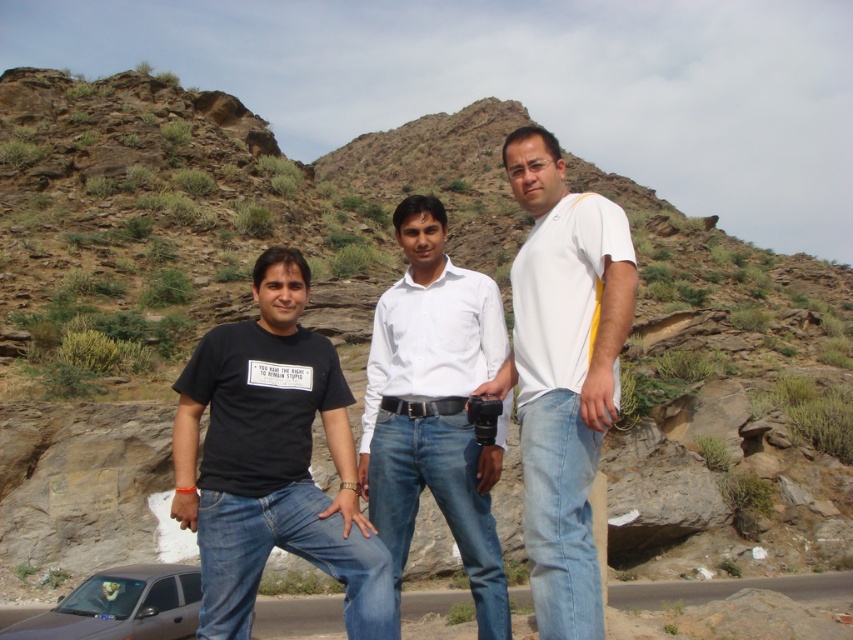
In the scene shown: How much distance is there between black matte t-shirt at left and white smooth shirt at center?

black matte t-shirt at left and white smooth shirt at center are 11.46 feet apart from each other.

Which is above, black matte t-shirt at left or white smooth shirt at center?

white smooth shirt at center is higher up.

Does point (305, 342) come closer to viewer compared to point (480, 456)?

No, (305, 342) is further to viewer.

Where is `black matte t-shirt at left`? Image resolution: width=853 pixels, height=640 pixels. black matte t-shirt at left is located at coordinates (271, 461).

Which is more to the right, white smooth shirt at center or brushed metal car at lower left?

From the viewer's perspective, brushed metal car at lower left appears more on the right side.

Can you confirm if white smooth shirt at center is smaller than brushed metal car at lower left?

Indeed, white smooth shirt at center has a smaller size compared to brushed metal car at lower left.

This screenshot has width=853, height=640. What do you see at coordinates (438, 416) in the screenshot? I see `white smooth shirt at center` at bounding box center [438, 416].

At what (x,y) coordinates should I click in order to perform the action: click on white smooth shirt at center. Please return your answer as a coordinate pair (x, y). This screenshot has height=640, width=853. Looking at the image, I should click on tap(438, 416).

Is point (560, 630) closer to camera compared to point (422, 416)?

That is True.

Can you confirm if white matte shirt at center is shorter than black leather belt at center?

In fact, white matte shirt at center may be taller than black leather belt at center.

At what (x,y) coordinates should I click in order to perform the action: click on white matte shirt at center. Please return your answer as a coordinate pair (x, y). Image resolution: width=853 pixels, height=640 pixels. Looking at the image, I should click on (563, 372).